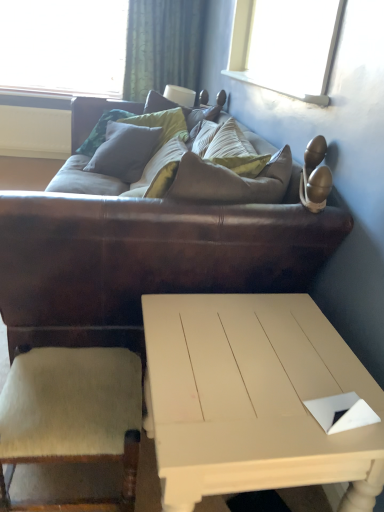
What is the approximate width of matte gray pillow at center?

18.18 inches.

What do you see at coordinates (162, 45) in the screenshot? Image resolution: width=384 pixels, height=512 pixels. I see `green textured curtain at upper center` at bounding box center [162, 45].

What do you see at coordinates (71, 414) in the screenshot? The image size is (384, 512). I see `beige wool armchair at lower left` at bounding box center [71, 414].

You are a GUI agent. You are given a task and a screenshot of the screen. Output one action in this format:
    pyautogui.click(x=<x>, y=<y>)
    Task: Click on the brown leather couch at center
    The height and width of the screenshot is (512, 384).
    Given the screenshot: What is the action you would take?
    pyautogui.click(x=145, y=260)

Considering the relative sizes of beige wool armchair at lower left and white painted wood coffee table at lower center in the image provided, is beige wool armchair at lower left smaller than white painted wood coffee table at lower center?

Correct, beige wool armchair at lower left occupies less space than white painted wood coffee table at lower center.

Is beige wool armchair at lower left to the right of white painted wood coffee table at lower center from the viewer's perspective?

No, beige wool armchair at lower left is not to the right of white painted wood coffee table at lower center.

Does beige wool armchair at lower left contain white painted wood coffee table at lower center?

No, white painted wood coffee table at lower center is located outside of beige wool armchair at lower left.

From a real-world perspective, is white painted wood coffee table at lower center above or below brown leather couch at center?

Clearly, from a real-world perspective, white painted wood coffee table at lower center is below brown leather couch at center.

Which is more to the right, white painted wood coffee table at lower center or brown leather couch at center?

white painted wood coffee table at lower center is more to the right.

Relative to brown leather couch at center, is white painted wood coffee table at lower center in front or behind?

Visually, white painted wood coffee table at lower center is located in front of brown leather couch at center.

From the image's perspective, is white painted wood coffee table at lower center on brown leather couch at center?

No, from the image's perspective, white painted wood coffee table at lower center is not on top of brown leather couch at center.

Between beige wool armchair at lower left and matte gray pillow at center, which one has less height?

Standing shorter between the two is beige wool armchair at lower left.

In the image, is beige wool armchair at lower left on the left side or the right side of matte gray pillow at center?

Based on their positions, beige wool armchair at lower left is located to the left of matte gray pillow at center.

Is beige wool armchair at lower left far away from matte gray pillow at center?

Yes, beige wool armchair at lower left and matte gray pillow at center are quite far apart.

Is beige wool armchair at lower left aimed at matte gray pillow at center?

No, beige wool armchair at lower left is not turned towards matte gray pillow at center.

Considering the relative sizes of matte gray pillow at center and green textured curtain at upper center in the image provided, is matte gray pillow at center bigger than green textured curtain at upper center?

No, matte gray pillow at center is not bigger than green textured curtain at upper center.

Can you confirm if matte gray pillow at center is taller than green textured curtain at upper center?

In fact, matte gray pillow at center may be shorter than green textured curtain at upper center.

Consider the image. Considering the sizes of matte gray pillow at center and green textured curtain at upper center in the image, is matte gray pillow at center wider or thinner than green textured curtain at upper center?

Considering their sizes, matte gray pillow at center looks broader than green textured curtain at upper center.

Is matte gray pillow at center at the left side of green textured curtain at upper center?

No, matte gray pillow at center is not to the left of green textured curtain at upper center.

Looking at this image, from a real-world perspective, is green textured curtain at upper center located higher than matte gray pillow at center?

Yes.

Find the location of `pillow in front of the green textured curtain at upper center`. pillow in front of the green textured curtain at upper center is located at coordinates (162, 124).

Considering the relative sizes of green textured curtain at upper center and matte gray pillow at center in the image provided, is green textured curtain at upper center wider than matte gray pillow at center?

Incorrect, the width of green textured curtain at upper center does not surpass that of matte gray pillow at center.

Is green textured curtain at upper center oriented towards brown leather couch at center?

Yes, green textured curtain at upper center is oriented towards brown leather couch at center.

From a real-world perspective, relative to brown leather couch at center, is green textured curtain at upper center vertically above or below?

From a real-world perspective, green textured curtain at upper center is physically above brown leather couch at center.

From the picture: From the image's perspective, is green textured curtain at upper center above brown leather couch at center?

Correct, green textured curtain at upper center appears higher than brown leather couch at center in the image.

Considering the sizes of objects green textured curtain at upper center and brown leather couch at center in the image provided, who is bigger, green textured curtain at upper center or brown leather couch at center?

Bigger between the two is brown leather couch at center.

Is the position of green textured curtain at upper center more distant than that of white painted wood coffee table at lower center?

Yes, green textured curtain at upper center is further from the camera.

Considering the relative sizes of green textured curtain at upper center and white painted wood coffee table at lower center in the image provided, is green textured curtain at upper center smaller than white painted wood coffee table at lower center?

Actually, green textured curtain at upper center might be larger than white painted wood coffee table at lower center.

At what (x,y) coordinates should I click in order to perform the action: click on curtain behind the white painted wood coffee table at lower center. Please return your answer as a coordinate pair (x, y). The image size is (384, 512). Looking at the image, I should click on (162, 45).

In the image, there is a white painted wood coffee table at lower center. Where is `armchair below it (from a real-world perspective)`? The width and height of the screenshot is (384, 512). armchair below it (from a real-world perspective) is located at coordinates (71, 414).

The image size is (384, 512). I want to click on studio couch above the white painted wood coffee table at lower center (from the image's perspective), so click(145, 260).

Considering their positions, is green textured curtain at upper center positioned further to matte gray pillow at center than beige wool armchair at lower left?

beige wool armchair at lower left.

From the image, which object appears to be nearer to matte gray pillow at center, white painted wood coffee table at lower center or green textured curtain at upper center?

green textured curtain at upper center is closer to matte gray pillow at center.

Estimate the real-world distances between objects in this image. Which object is further from brown leather couch at center, beige wool armchair at lower left or green textured curtain at upper center?

green textured curtain at upper center.

Estimate the real-world distances between objects in this image. Which object is closer to green textured curtain at upper center, matte gray pillow at center or brown leather couch at center?

Based on the image, matte gray pillow at center appears to be nearer to green textured curtain at upper center.

Which object lies further to the anchor point green textured curtain at upper center, white painted wood coffee table at lower center or matte gray pillow at center?

white painted wood coffee table at lower center lies further to green textured curtain at upper center than the other object.

When comparing their distances from green textured curtain at upper center, does white painted wood coffee table at lower center or beige wool armchair at lower left seem further?

beige wool armchair at lower left lies further to green textured curtain at upper center than the other object.

Based on their spatial positions, is brown leather couch at center or beige wool armchair at lower left further from green textured curtain at upper center?

beige wool armchair at lower left is further to green textured curtain at upper center.

When comparing their distances from beige wool armchair at lower left, does matte gray pillow at center or white painted wood coffee table at lower center seem further?

Among the two, matte gray pillow at center is located further to beige wool armchair at lower left.

At what (x,y) coordinates should I click in order to perform the action: click on armchair between white painted wood coffee table at lower center and green textured curtain at upper center in the front-back direction. Please return your answer as a coordinate pair (x, y). The image size is (384, 512). Looking at the image, I should click on (71, 414).

Image resolution: width=384 pixels, height=512 pixels. I want to click on pillow positioned between beige wool armchair at lower left and green textured curtain at upper center from near to far, so pos(162,124).

This screenshot has height=512, width=384. In order to click on armchair positioned between brown leather couch at center and green textured curtain at upper center from near to far in this screenshot , I will do `click(71, 414)`.

Image resolution: width=384 pixels, height=512 pixels. I want to click on studio couch between white painted wood coffee table at lower center and green textured curtain at upper center in the front-back direction, so click(145, 260).